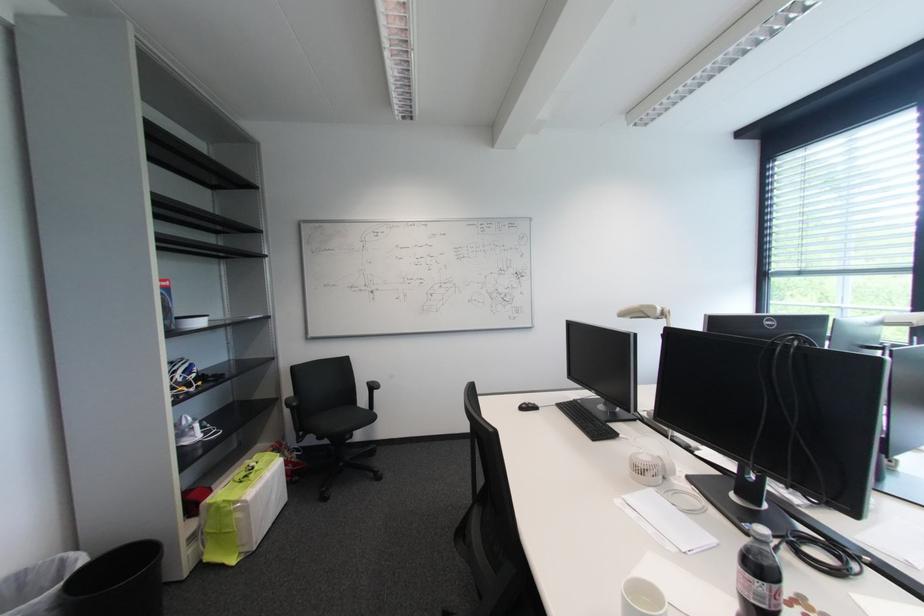
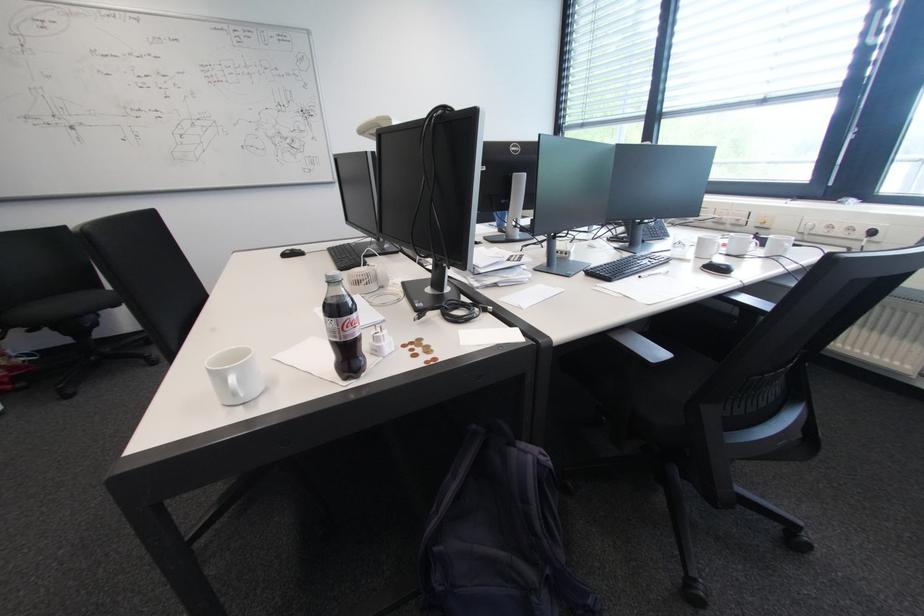
Question: What movement of the cameraman would produce the second image?

Choices:
 (A) Left
 (B) Right
 (C) Forward
 (D) Backward

Answer: (B)